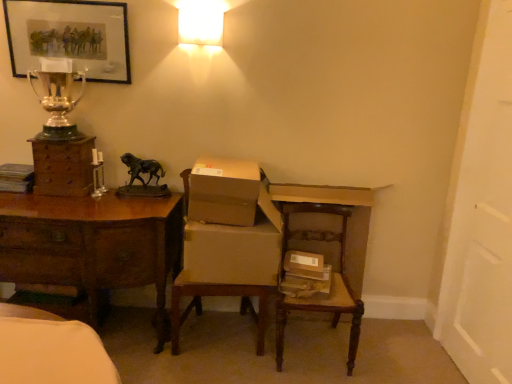
Where is `free point above brown wood desk at left (from a real-world perspective)`? Image resolution: width=512 pixels, height=384 pixels. free point above brown wood desk at left (from a real-world perspective) is located at coordinates (94, 205).